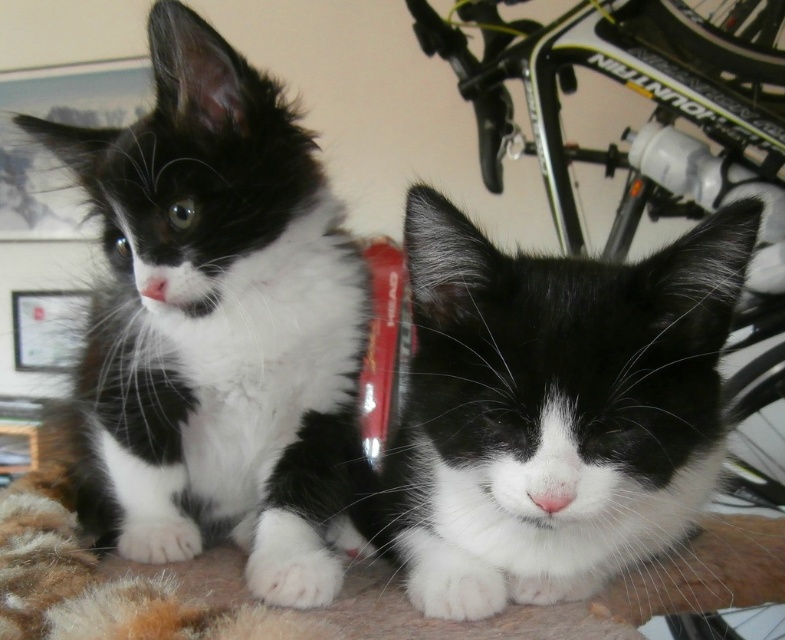
Is black and white fur cat at left below black soft fur cat at center?

Incorrect, black and white fur cat at left is not positioned below black soft fur cat at center.

Which is more to the left, black and white fur cat at left or black soft fur cat at center?

Positioned to the left is black and white fur cat at left.

Which is in front, point (331, 522) or point (482, 435)?

Point (482, 435) is in front.

This screenshot has height=640, width=785. I want to click on black and white fur cat at left, so click(x=217, y=323).